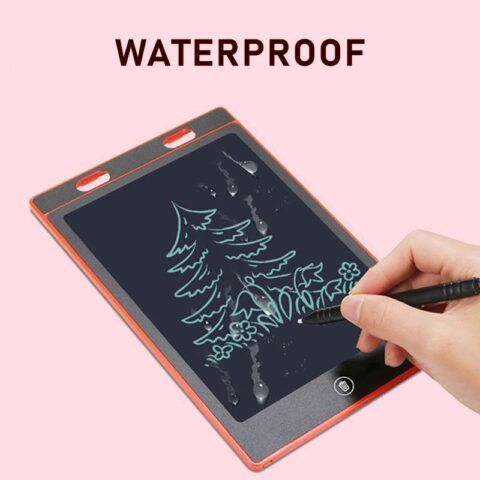
Locate an element on the screen. This screenshot has height=480, width=480. trash can circular icon is located at coordinates (342, 382).